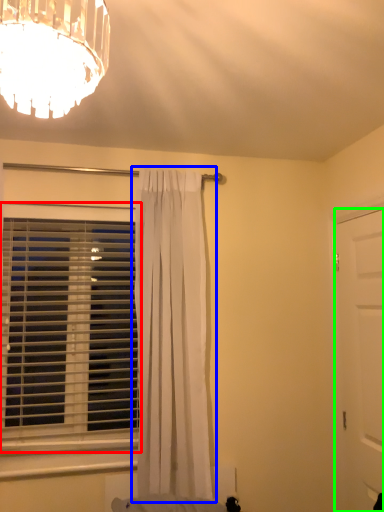
Question: Which is nearer to the window blind (highlighted by a red box)? curtain (highlighted by a blue box) or door (highlighted by a green box).

Choices:
 (A) curtain
 (B) door

Answer: (A)